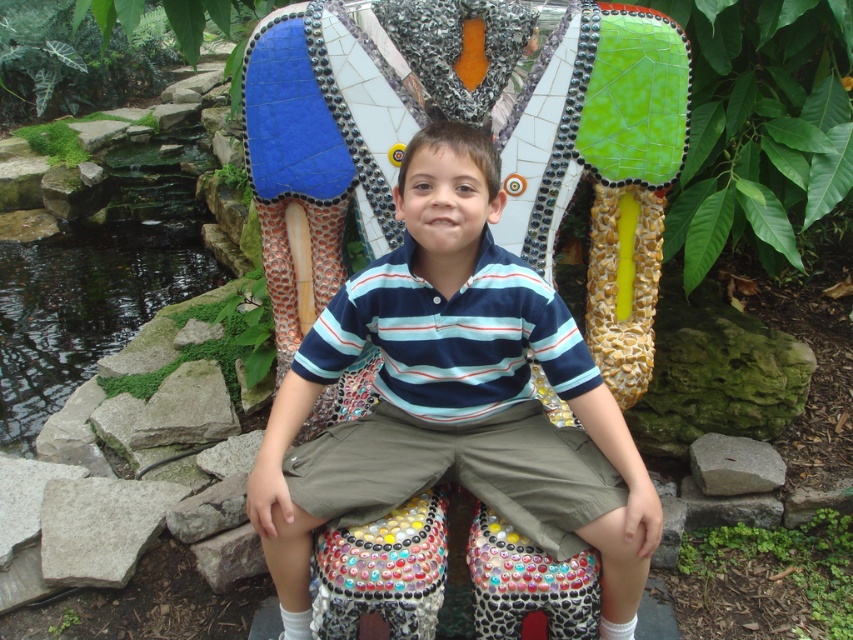
Question: Does striped cotton shirt at center have a larger size compared to green mossy rocks at left?

Choices:
 (A) no
 (B) yes

Answer: (A)

Question: Can you confirm if striped cotton shirt at center is positioned below green mossy rocks at left?

Choices:
 (A) yes
 (B) no

Answer: (A)

Question: Is striped cotton shirt at center thinner than green mossy rocks at left?

Choices:
 (A) yes
 (B) no

Answer: (A)

Question: Which point is farther to the camera?

Choices:
 (A) striped cotton shirt at center
 (B) green mossy rocks at left

Answer: (B)